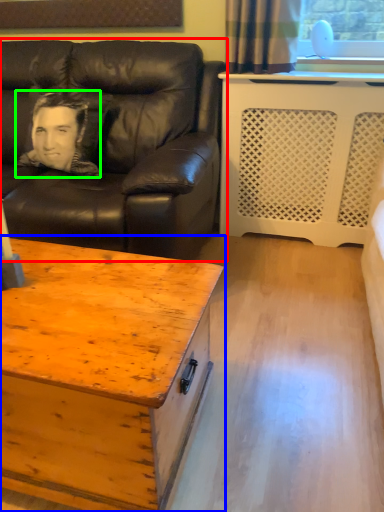
Question: Considering the real-world distances, which object is farthest from studio couch (highlighted by a red box)? coffee table (highlighted by a blue box) or man (highlighted by a green box)?

Choices:
 (A) coffee table
 (B) man

Answer: (A)